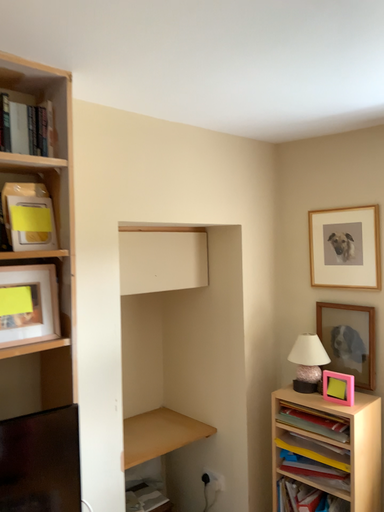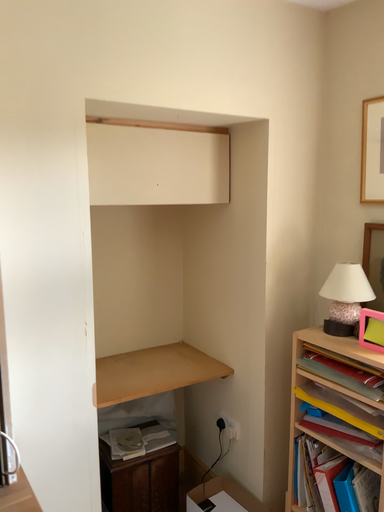
Question: How did the camera likely rotate when shooting the video?

Choices:
 (A) rotated left
 (B) rotated right

Answer: (A)